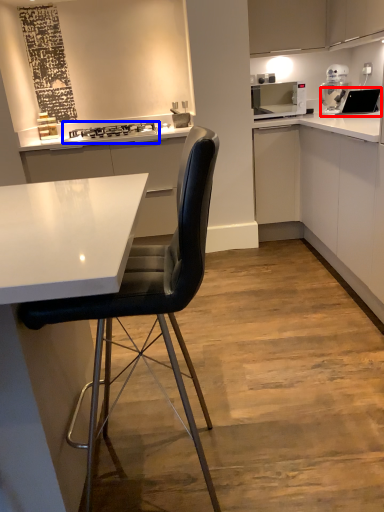
Question: Which point is closer to the camera, sink (highlighted by a red box) or stove (highlighted by a blue box)?

Choices:
 (A) sink
 (B) stove

Answer: (A)